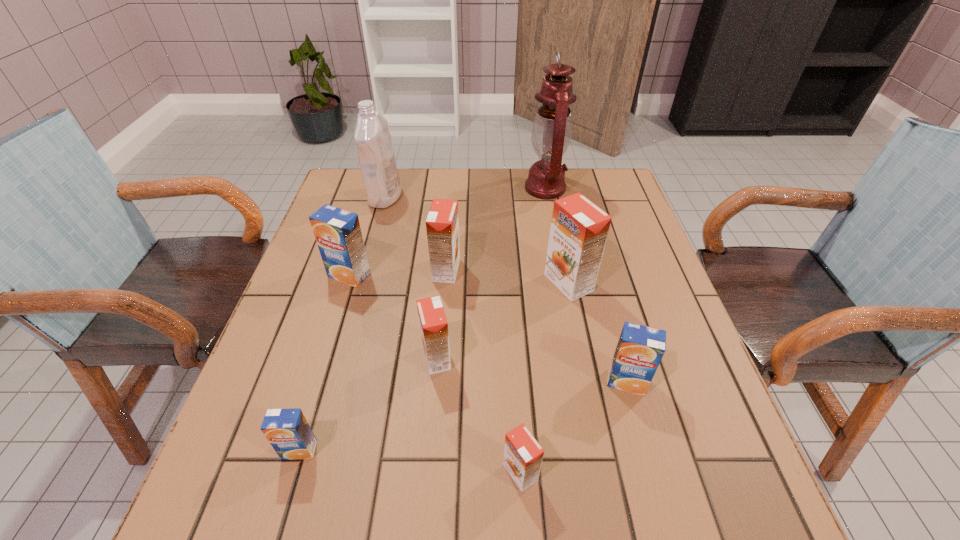
Identify the location of the second smallest blue orange_juice. This screenshot has width=960, height=540. (640, 348).

Identify the location of the nearest blue orange_juice. (287, 430).

You are a GUI agent. You are given a task and a screenshot of the screen. Output one action in this format:
    pyautogui.click(x=<x>, y=<y>)
    Task: Click on the fifth orange juice from left to right
    
    Given the screenshot: What is the action you would take?
    pyautogui.click(x=523, y=455)

The height and width of the screenshot is (540, 960). Find the location of `the sixth object from left to right`. the sixth object from left to right is located at coordinates (523, 455).

The width and height of the screenshot is (960, 540). What are the coordinates of `vacant space located 0.320m on the front of the tallest object` in the screenshot? It's located at click(564, 282).

Locate an element on the screen. This screenshot has height=540, width=960. free space located 0.400m on the right of the detergent is located at coordinates (535, 197).

Identify the location of vacant space located 0.140m on the front of the tallest orange juice. (583, 352).

Locate an element on the screen. blank space located 0.190m on the back of the biggest blue orange_juice is located at coordinates (367, 218).

Where is `blank space located 0.250m on the right of the third smallest orange orange juice`? This screenshot has width=960, height=540. blank space located 0.250m on the right of the third smallest orange orange juice is located at coordinates (561, 270).

At what (x,y) coordinates should I click in order to perform the action: click on free spot located 0.110m on the back of the second nearest orange orange juice. Please return your answer as a coordinate pair (x, y). Looking at the image, I should click on (442, 304).